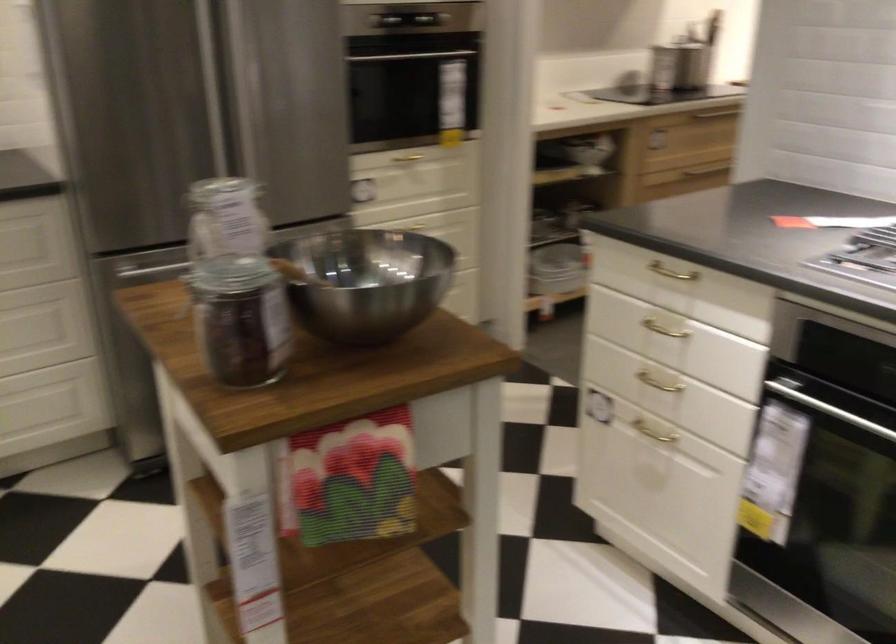
Where would you pull the cabinet handle? Please return your answer as a coordinate pair (x, y).

(716, 114)